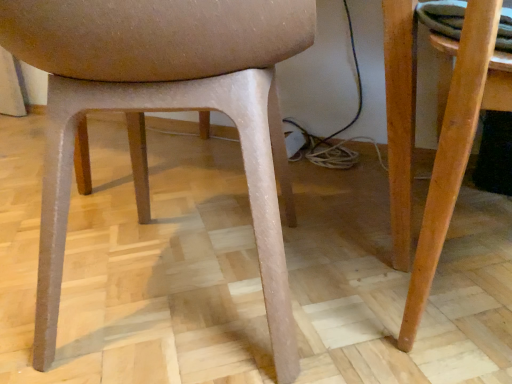
Question: From a real-world perspective, is wooden table at right physically located above or below matte plastic chair at center?

Choices:
 (A) above
 (B) below

Answer: (B)

Question: Is wooden table at right wider or thinner than matte plastic chair at center?

Choices:
 (A) wide
 (B) thin

Answer: (B)

Question: Is point (409, 292) positioned closer to the camera than point (273, 266)?

Choices:
 (A) closer
 (B) farther

Answer: (B)

Question: Considering the relative positions of matte plastic chair at center and wooden table at right in the image provided, is matte plastic chair at center to the left or to the right of wooden table at right?

Choices:
 (A) right
 (B) left

Answer: (B)

Question: Looking at the image, does matte plastic chair at center seem bigger or smaller compared to wooden table at right?

Choices:
 (A) big
 (B) small

Answer: (A)

Question: In the image, is matte plastic chair at center positioned in front of or behind wooden table at right?

Choices:
 (A) behind
 (B) front

Answer: (B)

Question: Is matte plastic chair at center spatially inside wooden table at right, or outside of it?

Choices:
 (A) inside
 (B) outside

Answer: (B)